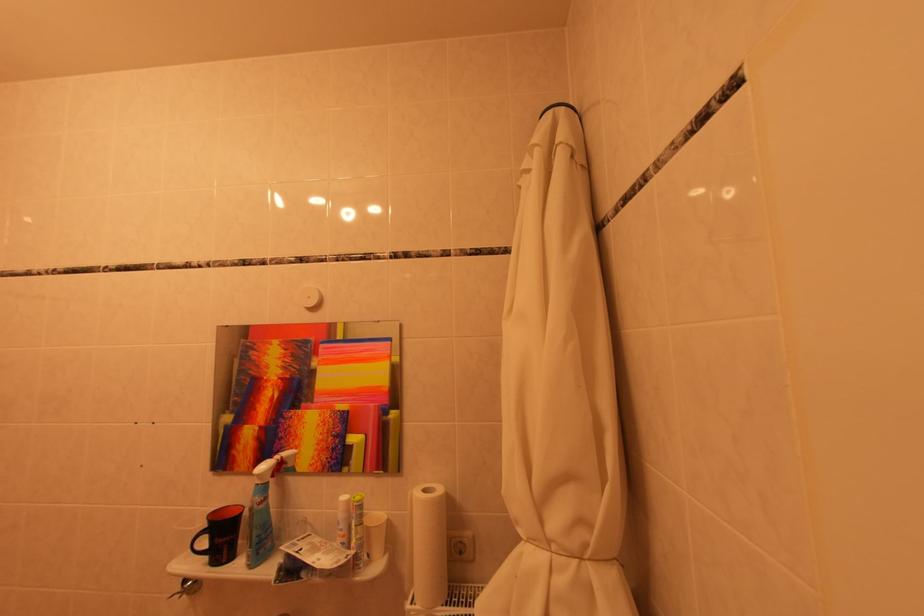
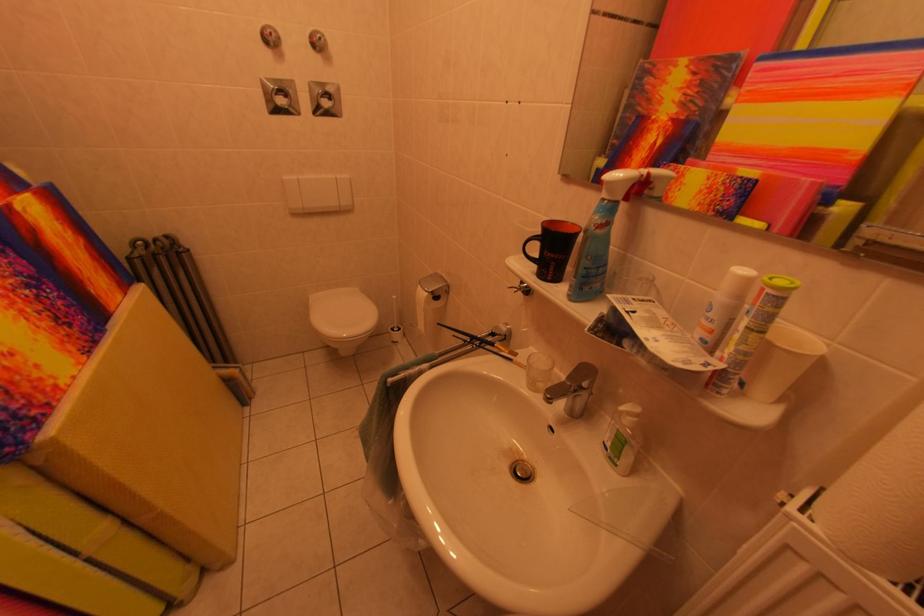
The first image is from the beginning of the video and the second image is from the end. How did the camera likely rotate when shooting the video?

The rotation direction of the camera is left-down.